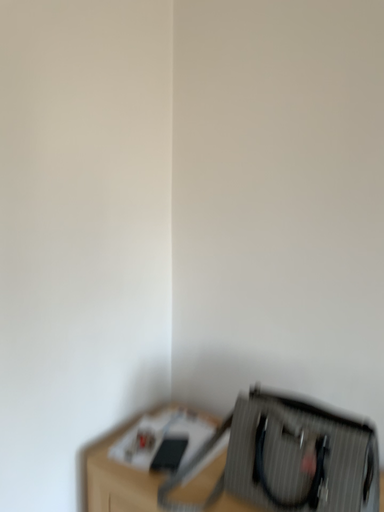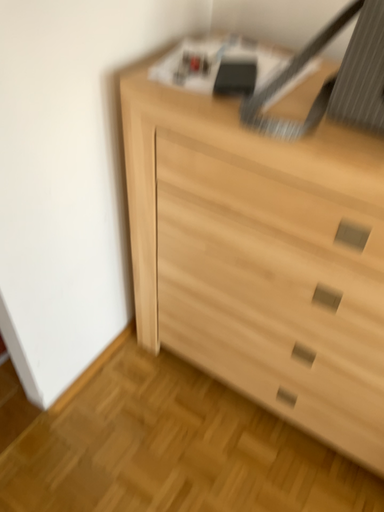
Question: Which way did the camera rotate in the video?

Choices:
 (A) rotated upward
 (B) rotated downward

Answer: (B)